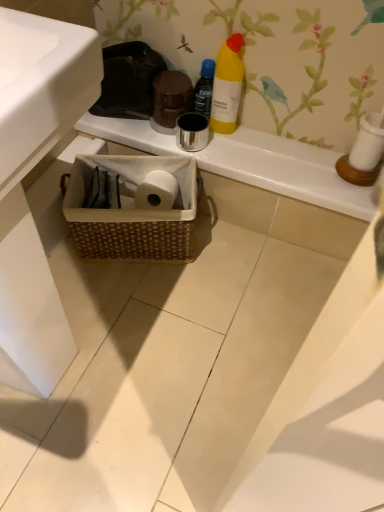
Where is `free space in front of woven brown basket at lower center`? This screenshot has height=512, width=384. free space in front of woven brown basket at lower center is located at coordinates (144, 298).